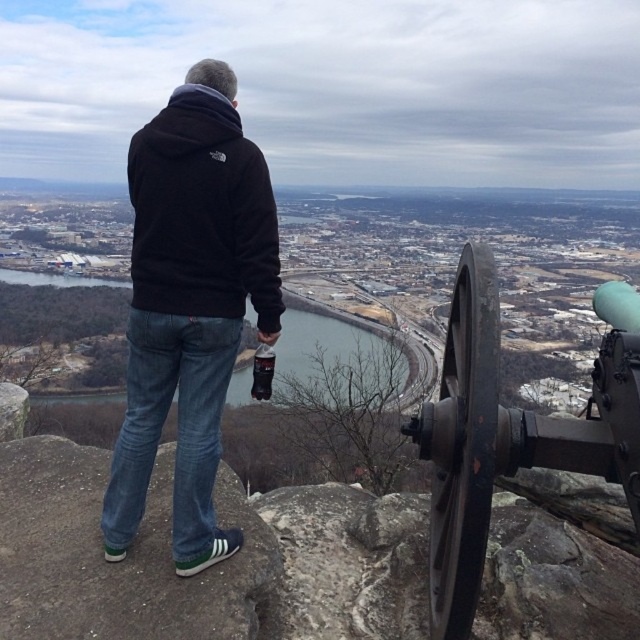
Question: Can you confirm if black matte hoodie at center is wider than blue jeans at center?

Choices:
 (A) yes
 (B) no

Answer: (A)

Question: Does black matte hoodie at center have a larger size compared to black fleece hoodie at upper center?

Choices:
 (A) yes
 (B) no

Answer: (A)

Question: Considering the real-world distances, which object is closest to the blue jeans at center?

Choices:
 (A) black matte hoodie at center
 (B) black fleece hoodie at upper center

Answer: (A)

Question: Observing the image, what is the correct spatial positioning of blue jeans at center in reference to black fleece hoodie at upper center?

Choices:
 (A) right
 (B) left

Answer: (A)

Question: Which point is farther to the camera?

Choices:
 (A) blue jeans at center
 (B) black fleece hoodie at upper center

Answer: (B)

Question: Which point appears closest to the camera in this image?

Choices:
 (A) pos(188,200)
 (B) pos(563,465)
 (C) pos(278,300)

Answer: (B)